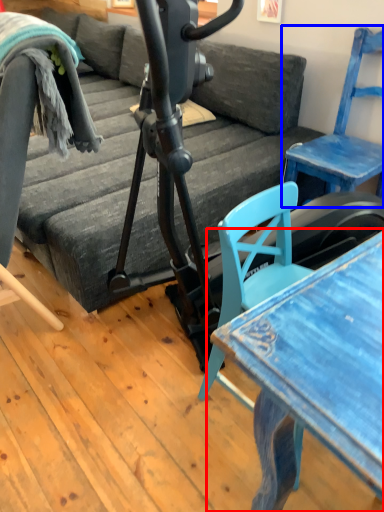
Question: Which of the following is the closest to the observer, table (highlighted by a red box) or chair (highlighted by a blue box)?

Choices:
 (A) table
 (B) chair

Answer: (A)